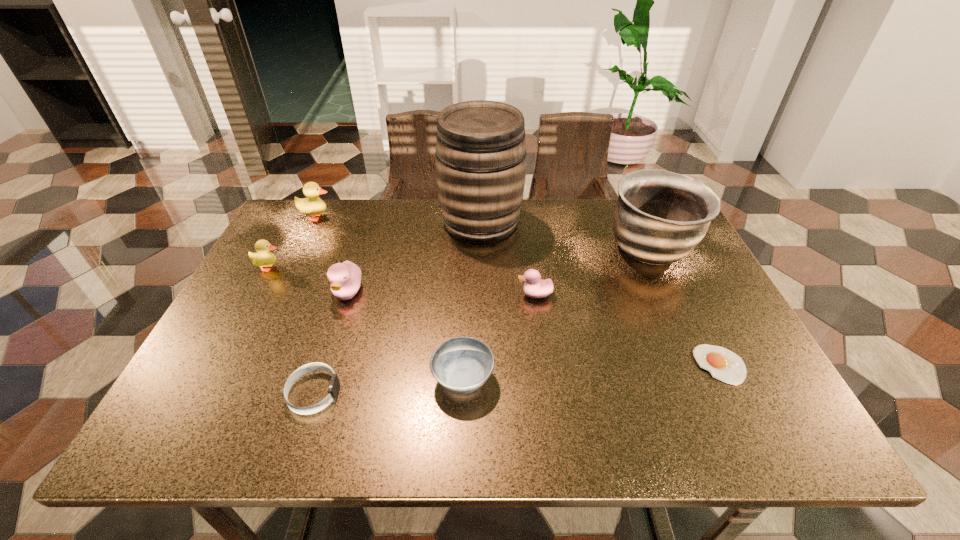
Identify the location of wine bucket. (480, 152).

The height and width of the screenshot is (540, 960). I want to click on pottery, so click(660, 216).

Locate an element on the screen. the farthest duckling is located at coordinates (313, 205).

At what (x,y) coordinates should I click in order to perform the action: click on the bigger yellow duckling. Please return your answer as a coordinate pair (x, y). Image resolution: width=960 pixels, height=540 pixels. Looking at the image, I should click on pyautogui.click(x=313, y=205).

This screenshot has height=540, width=960. What are the coordinates of `the left pink duckling` in the screenshot? It's located at (345, 278).

Identify the location of the bigger pink duckling. (345, 278).

Where is `the smaller yellow duckling`? This screenshot has width=960, height=540. the smaller yellow duckling is located at coordinates (263, 258).

This screenshot has width=960, height=540. Find the location of `the nearer yellow duckling`. the nearer yellow duckling is located at coordinates (263, 258).

Where is `the rightmost duckling`? This screenshot has width=960, height=540. the rightmost duckling is located at coordinates (534, 287).

Identify the location of the right pink duckling. (534, 287).